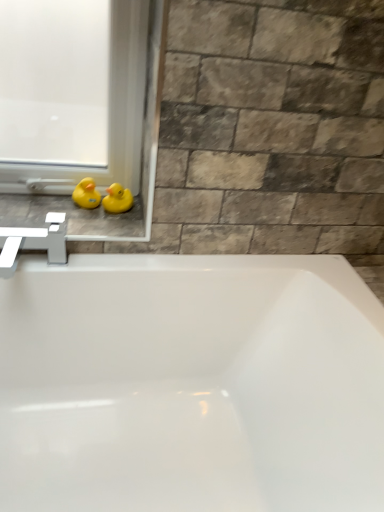
The height and width of the screenshot is (512, 384). I want to click on free point above yellow rubber duck at left (from a real-world perspective), so click(64, 215).